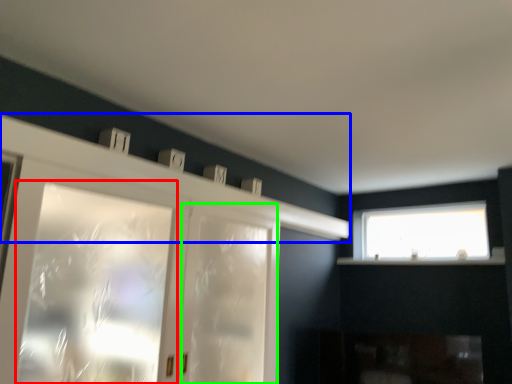
Question: Considering the real-world distances, which object is farthest from window (highlighted by a red box)? mantle (highlighted by a blue box) or screen door (highlighted by a green box)?

Choices:
 (A) mantle
 (B) screen door

Answer: (A)